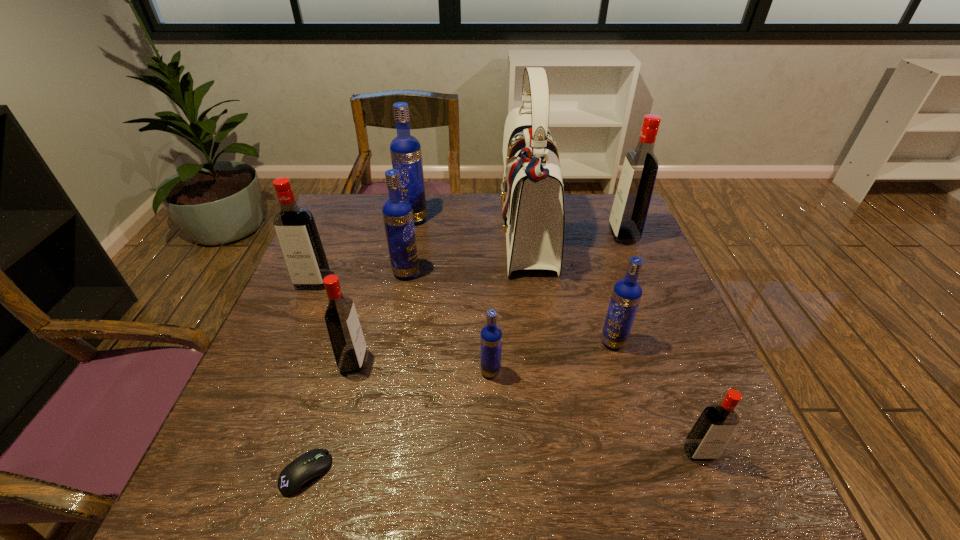
This screenshot has width=960, height=540. Find the location of `the second nearest red vodka`. the second nearest red vodka is located at coordinates (349, 347).

Locate an element on the screen. The width and height of the screenshot is (960, 540). the fourth vodka from right to left is located at coordinates (491, 335).

You are a GUI agent. You are given a task and a screenshot of the screen. Output one action in this format:
    pyautogui.click(x=<x>, y=<y>)
    Task: Click on the nearest blue vodka
    
    Given the screenshot: What is the action you would take?
    pyautogui.click(x=491, y=335)

Where is `the smallest red vodka`? the smallest red vodka is located at coordinates (710, 434).

This screenshot has height=540, width=960. I want to click on the nearest red vodka, so click(x=710, y=434).

The image size is (960, 540). Find the location of `the shortest object`. the shortest object is located at coordinates (295, 477).

Where is `black computer equipment`? The image size is (960, 540). black computer equipment is located at coordinates (295, 477).

Locate an element on the screen. free space located on the front-facing side of the seventh object from left to right is located at coordinates (406, 234).

Where is `blank space located on the front-facing side of the seventh object from left to right`? blank space located on the front-facing side of the seventh object from left to right is located at coordinates (472, 234).

Find the location of a particular element. The height and width of the screenshot is (540, 960). vacant space located on the front-facing side of the seventh object from left to right is located at coordinates (439, 234).